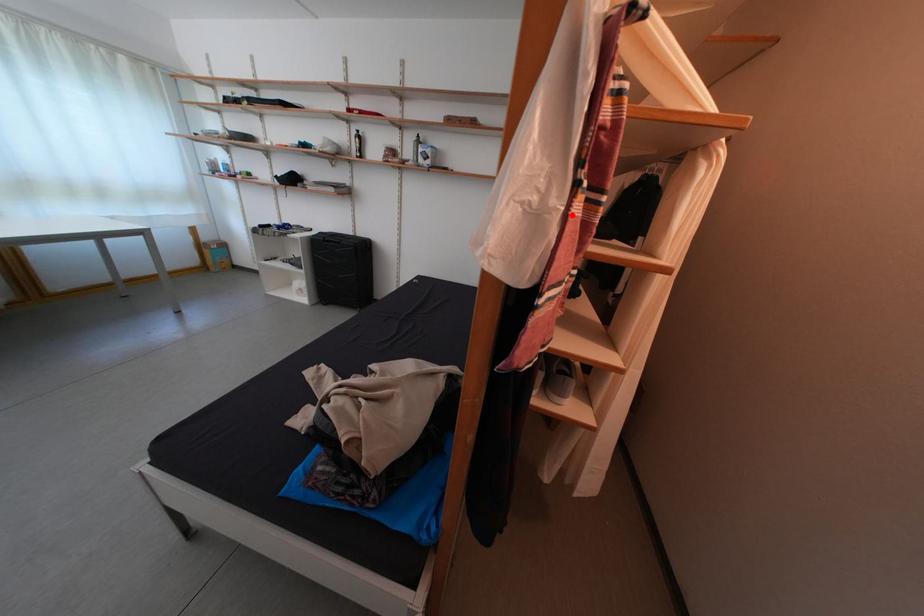
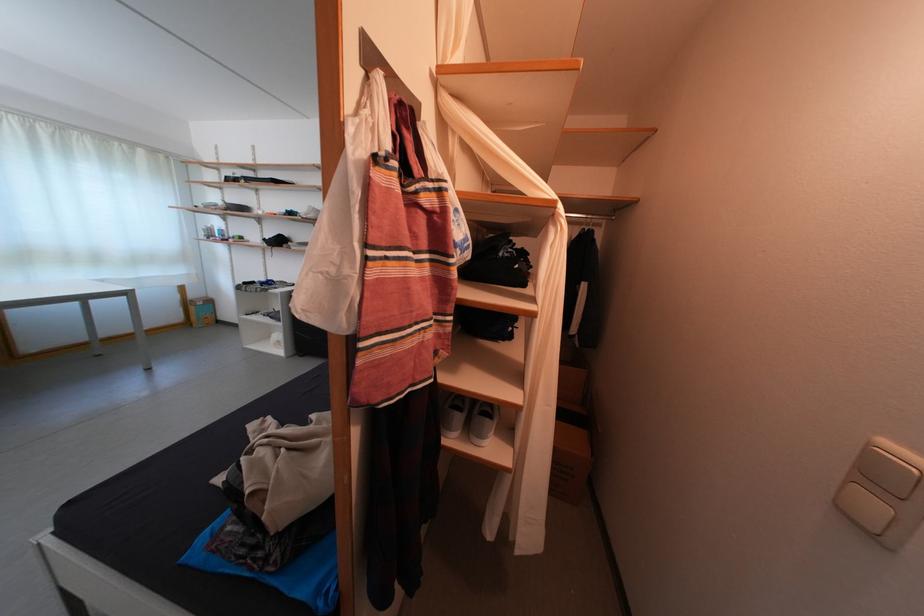
Question: I am providing you with two images of the same scene from different viewpoints. A red point is marked on the first image. Can you still see the location of the red point in image 2?

Choices:
 (A) Yes
 (B) No

Answer: (A)